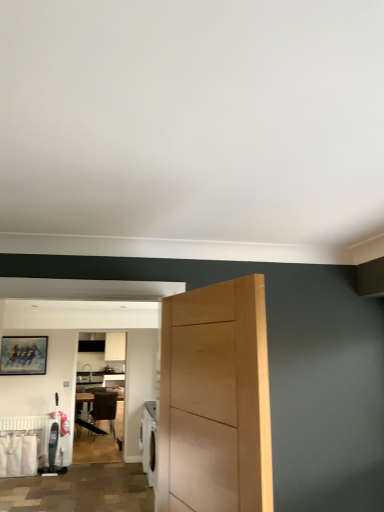
Question: From the image's perspective, does white matte radiator at lower left appear lower than wooden chair at center?

Choices:
 (A) no
 (B) yes

Answer: (A)

Question: Is white matte radiator at lower left at the left side of wooden chair at center?

Choices:
 (A) yes
 (B) no

Answer: (A)

Question: Does white matte radiator at lower left have a greater height compared to wooden chair at center?

Choices:
 (A) no
 (B) yes

Answer: (A)

Question: Can you confirm if white matte radiator at lower left is shorter than wooden chair at center?

Choices:
 (A) yes
 (B) no

Answer: (A)

Question: From the image's perspective, is white matte radiator at lower left on wooden chair at center?

Choices:
 (A) no
 (B) yes

Answer: (B)

Question: Does white matte radiator at lower left have a larger size compared to wooden chair at center?

Choices:
 (A) no
 (B) yes

Answer: (A)

Question: Can you confirm if wooden chair at center is positioned to the right of wooden table at center?

Choices:
 (A) no
 (B) yes

Answer: (B)

Question: From the image's perspective, is wooden chair at center over wooden table at center?

Choices:
 (A) yes
 (B) no

Answer: (A)

Question: Does wooden chair at center have a lesser width compared to wooden table at center?

Choices:
 (A) yes
 (B) no

Answer: (A)

Question: Is wooden table at center at the back of wooden chair at center?

Choices:
 (A) yes
 (B) no

Answer: (A)

Question: Is wooden chair at center to the left of wooden table at center from the viewer's perspective?

Choices:
 (A) no
 (B) yes

Answer: (A)

Question: Does wooden chair at center turn towards wooden table at center?

Choices:
 (A) yes
 (B) no

Answer: (A)

Question: Is wooden chair at center completely or partially inside wooden table at center?

Choices:
 (A) yes
 (B) no

Answer: (A)